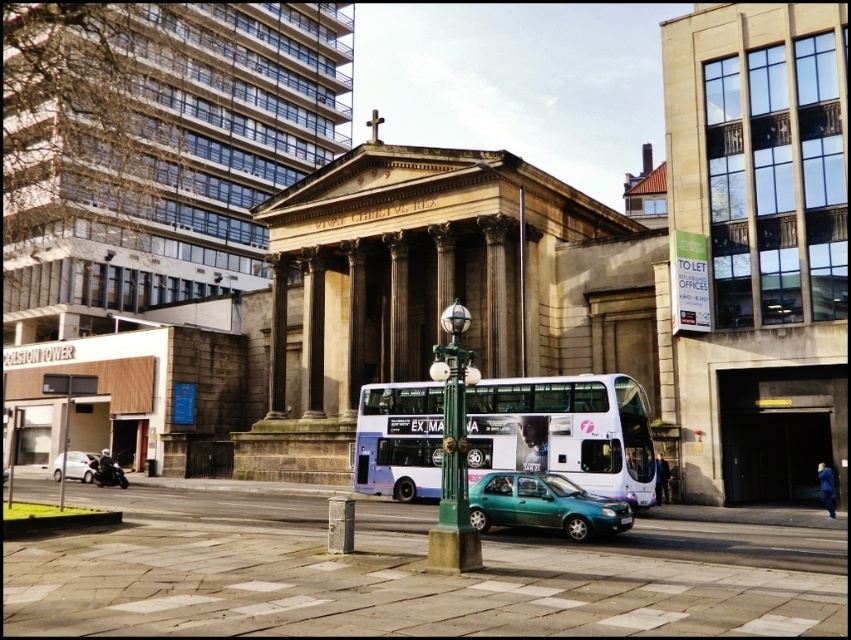
From the picture: Is green polished metal streetlight at center further to camera compared to silver metallic car at lower left?

No.

This screenshot has height=640, width=851. What do you see at coordinates (453, 451) in the screenshot?
I see `green polished metal streetlight at center` at bounding box center [453, 451].

Is point (447, 348) behind point (92, 458)?

No, (447, 348) is in front of (92, 458).

Find the location of a particular element. This screenshot has height=640, width=851. green polished metal streetlight at center is located at coordinates (453, 451).

Is green polished metal streetlight at center below teal matte hatchback at center?

Incorrect, green polished metal streetlight at center is not positioned below teal matte hatchback at center.

Can you confirm if green polished metal streetlight at center is positioned above teal matte hatchback at center?

Yes, green polished metal streetlight at center is above teal matte hatchback at center.

What do you see at coordinates (453, 451) in the screenshot? This screenshot has width=851, height=640. I see `green polished metal streetlight at center` at bounding box center [453, 451].

Find the location of a particular element. green polished metal streetlight at center is located at coordinates (453, 451).

This screenshot has height=640, width=851. What do you see at coordinates (544, 506) in the screenshot? I see `teal matte hatchback at center` at bounding box center [544, 506].

Can you confirm if teal matte hatchback at center is positioned to the right of silver metallic car at lower left?

Yes, teal matte hatchback at center is to the right of silver metallic car at lower left.

Image resolution: width=851 pixels, height=640 pixels. What are the coordinates of `teal matte hatchback at center` in the screenshot? It's located at click(544, 506).

At what (x,y) coordinates should I click in order to perform the action: click on teal matte hatchback at center. Please return your answer as a coordinate pair (x, y). This screenshot has width=851, height=640. Looking at the image, I should click on (544, 506).